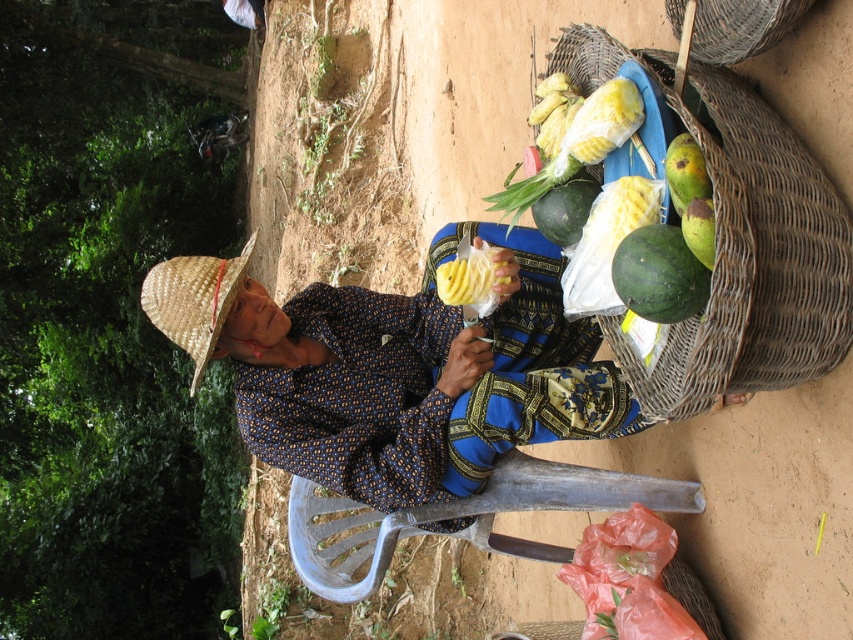
Question: Among these points, which one is farthest from the camera?

Choices:
 (A) (479, 461)
 (B) (556, 237)
 (C) (471, 262)
 (D) (685, 236)

Answer: (A)

Question: Does green matte watermelon at right have a larger size compared to green matte watermelon at center?

Choices:
 (A) no
 (B) yes

Answer: (A)

Question: Which of the following is the closest to the observer?

Choices:
 (A) (537, 218)
 (B) (692, 195)
 (C) (456, 273)
 (D) (724, 202)

Answer: (D)

Question: Considering the relative positions of straw hat at left and green matte watermelon at right in the image provided, where is straw hat at left located with respect to green matte watermelon at right?

Choices:
 (A) below
 (B) above

Answer: (A)

Question: Can you confirm if straw hat at left is bigger than green matte mango at right?

Choices:
 (A) no
 (B) yes

Answer: (B)

Question: Estimate the real-world distances between objects in this image. Which object is farther from the rattan basket at right?

Choices:
 (A) woven bamboo basket at upper right
 (B) yellow matte pineapple at center
 (C) green matte watermelon at right

Answer: (B)